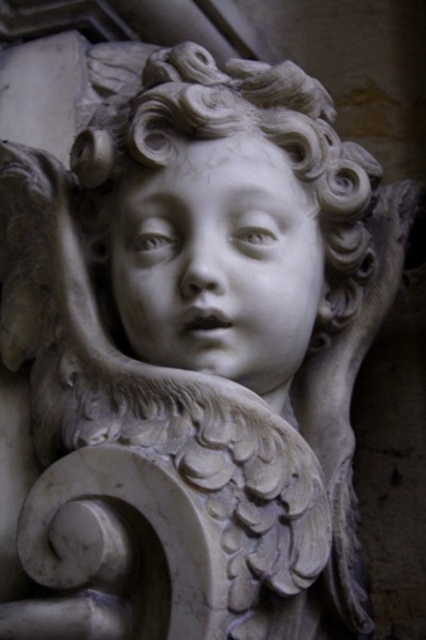
Question: Which point is farther to the camera?

Choices:
 (A) white marble head at center
 (B) white marble face at center

Answer: (B)

Question: Does white marble head at center appear under white marble face at center?

Choices:
 (A) yes
 (B) no

Answer: (B)

Question: Which object is farther from the camera taking this photo?

Choices:
 (A) white marble head at center
 (B) white marble face at center

Answer: (B)

Question: Can you confirm if white marble head at center is positioned to the right of white marble face at center?

Choices:
 (A) yes
 (B) no

Answer: (A)

Question: In this image, where is white marble head at center located relative to white marble face at center?

Choices:
 (A) left
 (B) right

Answer: (B)

Question: Which object appears farthest from the camera in this image?

Choices:
 (A) white marble head at center
 (B) white marble face at center

Answer: (B)